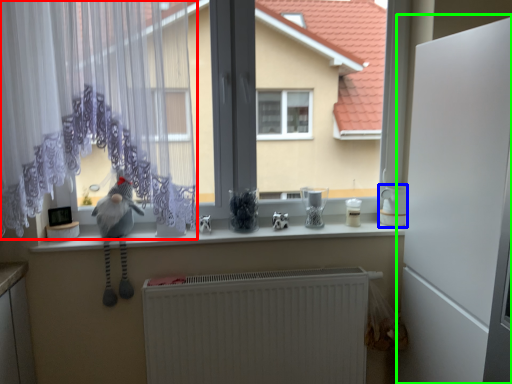
Question: Based on their relative distances, which object is nearer to curtain (highlighted by a red box)? Choose from appliance (highlighted by a blue box) and screen door (highlighted by a green box).

Choices:
 (A) appliance
 (B) screen door

Answer: (B)